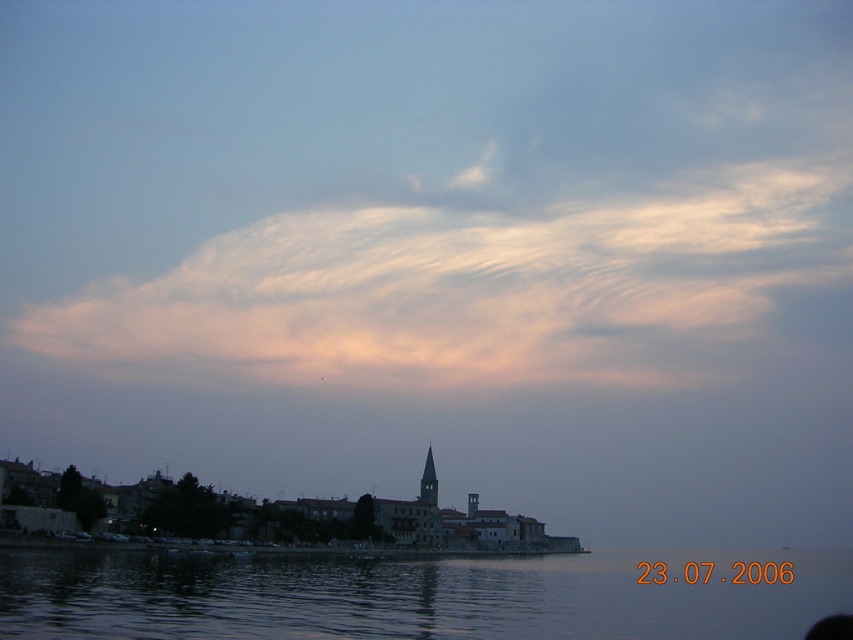
You are a pilot flying a small plane and need to navigate around the white fluffy cloud at upper center located at point (477,289). Can you safely fly your plane below the cloud without hitting it?

The white fluffy cloud at upper center is located at point (477,289), so yes, you can safely fly your plane below it as long as you maintain a safe altitude below that point.

You are standing on the beach and see the transparent water at lower center and the dark gray stone tower at center. Which object takes up more space in the image?

The transparent water at lower center takes up more space in the image as it is larger in size than the dark gray stone tower at center.

You are an artist trying to paint the coastal scene. You want to ensure the white fluffy cloud at upper center and the transparent water at lower center are proportionally accurate. Which object should you paint first if you want to start with the smaller one?

The white fluffy cloud at upper center is smaller than transparent water at lower center, so you should paint the white fluffy cloud at upper center first.